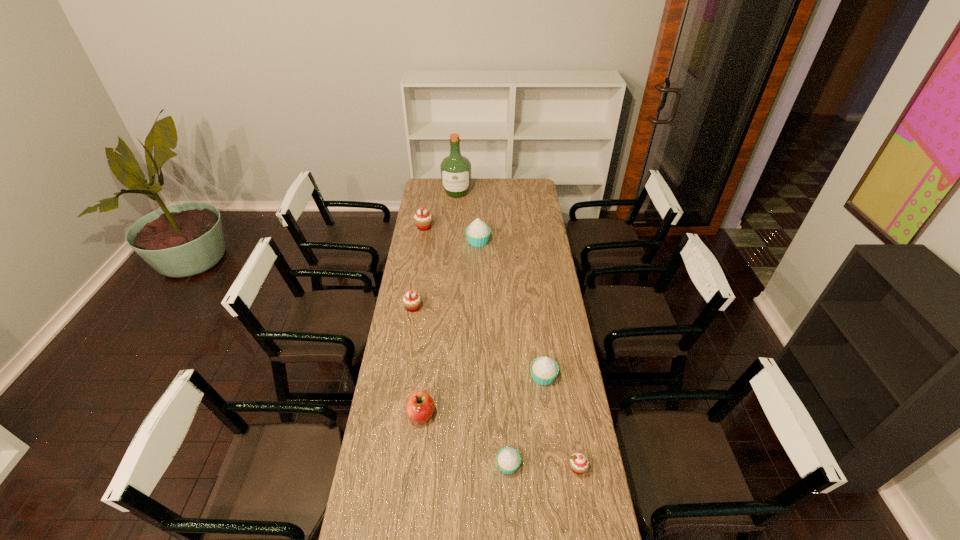
Locate an element on the screen. This screenshot has width=960, height=540. apple is located at coordinates (420, 406).

Find the location of a particular element. the nearest white cupcake is located at coordinates (508, 459).

Where is `the rightmost pink cupcake`? the rightmost pink cupcake is located at coordinates (579, 463).

Locate an element on the screen. The width and height of the screenshot is (960, 540). the nearest pink cupcake is located at coordinates (579, 463).

Locate an element on the screen. This screenshot has width=960, height=540. free space located 0.210m on the front-facing side of the farthest object is located at coordinates (455, 221).

I want to click on vacant region located 0.320m on the front of the second farthest cupcake, so click(478, 291).

Identify the location of vacant space located 0.100m on the front of the biggest pink cupcake. (421, 245).

Where is `vacant space situated on the right of the fourth farthest object`? The height and width of the screenshot is (540, 960). vacant space situated on the right of the fourth farthest object is located at coordinates (477, 308).

Locate an element on the screen. The height and width of the screenshot is (540, 960). vacant space situated on the front of the fourth farthest cupcake is located at coordinates (552, 445).

You are a GUI agent. You are given a task and a screenshot of the screen. Output one action in this format:
    pyautogui.click(x=<x>, y=<y>)
    Task: Click on the free spot located on the right of the third nearest object
    This screenshot has width=960, height=540.
    Given the screenshot: What is the action you would take?
    pyautogui.click(x=506, y=414)